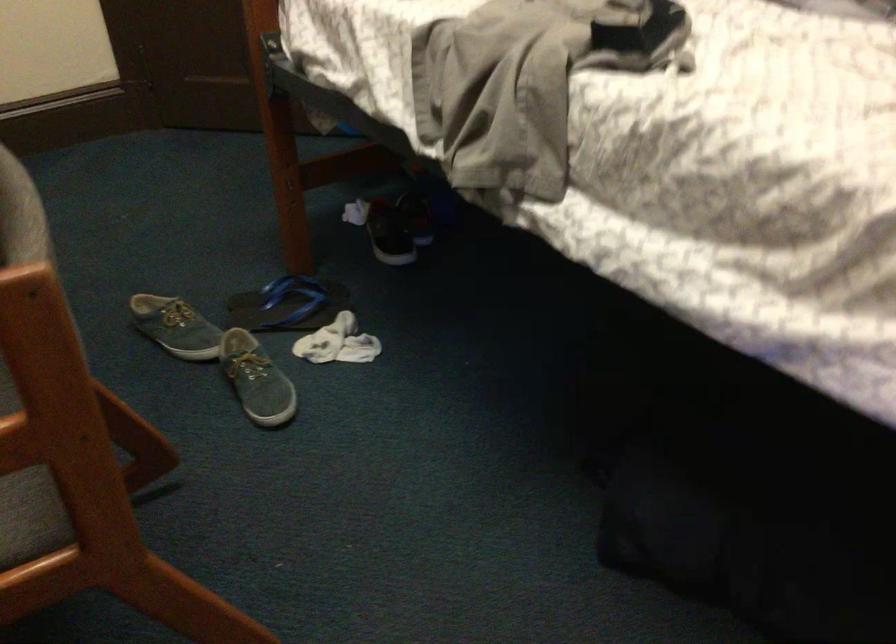
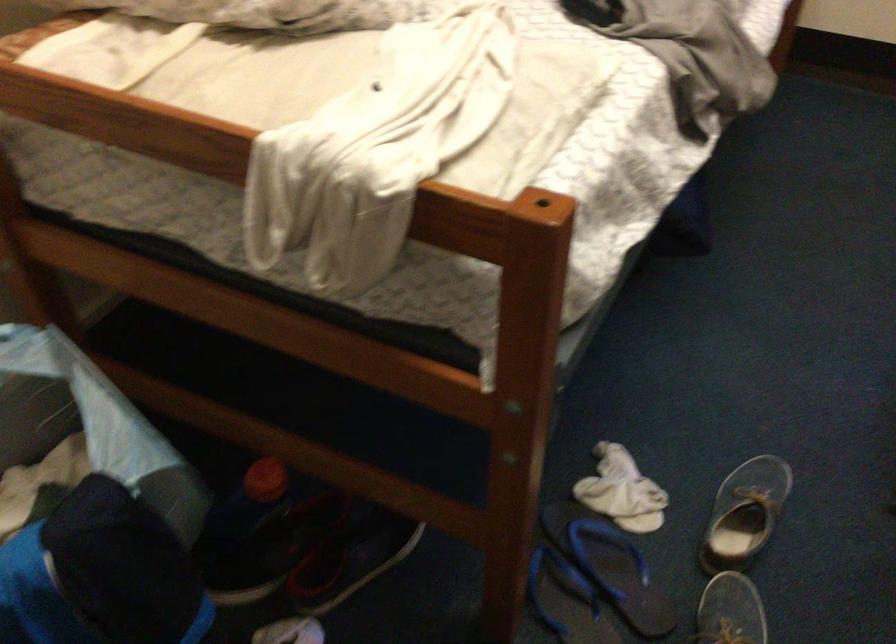
Where in the second image is the point corresponding to [247,366] from the first image?

(745, 514)